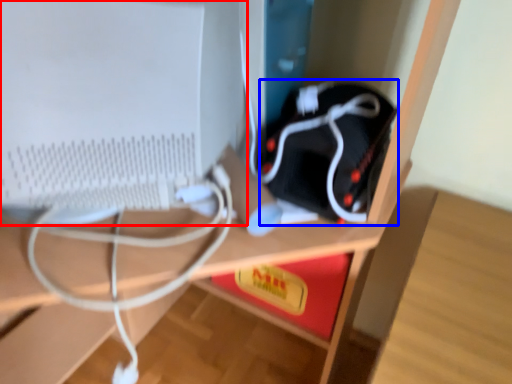
Question: Which of the following is the farthest to the observer, computer monitor (highlighted by a red box) or equipment (highlighted by a blue box)?

Choices:
 (A) computer monitor
 (B) equipment

Answer: (B)